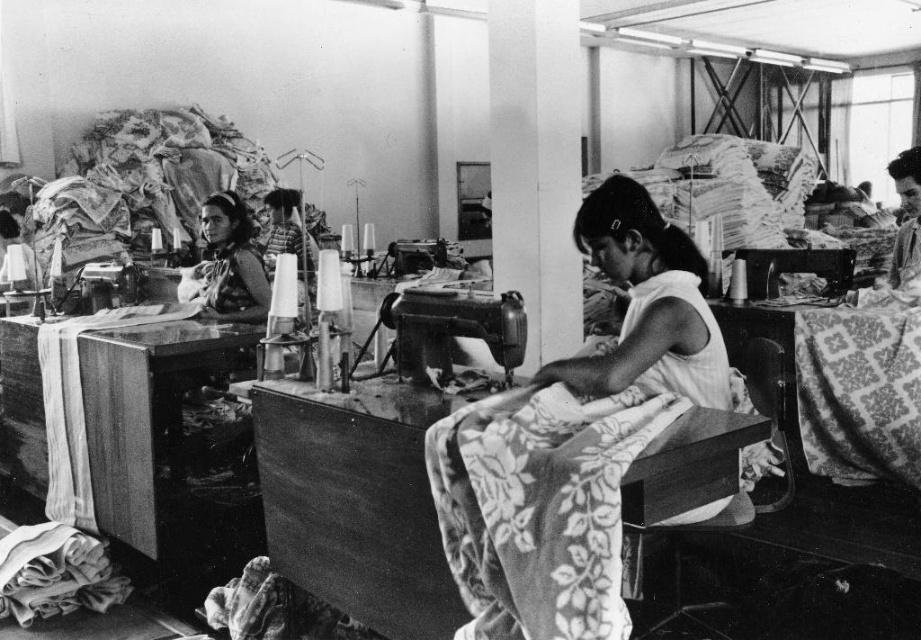
Question: In this image, where is floral-patterned fabric at center located relative to matte fabric headscarf at center?

Choices:
 (A) left
 (B) right

Answer: (B)

Question: Which point is farther to the camera?

Choices:
 (A) white fabric at center
 (B) matte fabric headscarf at center

Answer: (B)

Question: Considering the real-world distances, which object is farthest from the patterned fabric at center?

Choices:
 (A) soft cotton fabric at lower left
 (B) floral-patterned fabric at center
 (C) matte fabric headscarf at center
 (D) metallic sewing machine at center

Answer: (A)

Question: Is the position of floral-patterned fabric at center less distant than that of matte fabric headscarf at center?

Choices:
 (A) yes
 (B) no

Answer: (A)

Question: Does white fabric at center appear over patterned fabric at center?

Choices:
 (A) yes
 (B) no

Answer: (A)

Question: Estimate the real-world distances between objects in this image. Which object is farther from the white fabric at center?

Choices:
 (A) patterned fabric at center
 (B) floral-patterned fabric at center

Answer: (A)